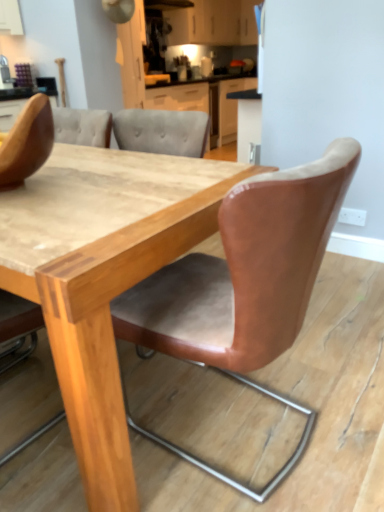
Question: Considering the relative sizes of leather-like tan chair at center, the 1th chair in the right-to-left sequence, and matte white cabinets at upper center in the image provided, is leather-like tan chair at center, the 1th chair in the right-to-left sequence, shorter than matte white cabinets at upper center?

Choices:
 (A) no
 (B) yes

Answer: (A)

Question: Is leather-like tan chair at center, positioned as the second chair in left-to-right order, at the left side of matte white cabinets at upper center?

Choices:
 (A) no
 (B) yes

Answer: (B)

Question: Considering the relative positions of leather-like tan chair at center, the 1th chair in the right-to-left sequence, and matte white cabinets at upper center in the image provided, is leather-like tan chair at center, the 1th chair in the right-to-left sequence, in front of matte white cabinets at upper center?

Choices:
 (A) yes
 (B) no

Answer: (A)

Question: From a real-world perspective, does leather-like tan chair at center, the 1th chair in the right-to-left sequence, stand above matte white cabinets at upper center?

Choices:
 (A) no
 (B) yes

Answer: (A)

Question: Is leather-like tan chair at center, the 1th chair in the right-to-left sequence, with matte white cabinets at upper center?

Choices:
 (A) yes
 (B) no

Answer: (B)

Question: Based on their positions, is leather-like tan chair at center, positioned as the second chair in left-to-right order, located to the left or right of brown leather chair at upper left, which is counted as the 1th chair, starting from the left?

Choices:
 (A) right
 (B) left

Answer: (A)

Question: Considering the positions of leather-like tan chair at center, the 1th chair in the right-to-left sequence, and brown leather chair at upper left, which is counted as the 1th chair, starting from the left, in the image, is leather-like tan chair at center, the 1th chair in the right-to-left sequence, taller or shorter than brown leather chair at upper left, which is counted as the 1th chair, starting from the left,?

Choices:
 (A) short
 (B) tall

Answer: (B)

Question: Considering the positions of leather-like tan chair at center, the 1th chair in the right-to-left sequence, and brown leather chair at upper left, arranged as the second chair when viewed from the right, in the image, is leather-like tan chair at center, the 1th chair in the right-to-left sequence, bigger or smaller than brown leather chair at upper left, arranged as the second chair when viewed from the right,?

Choices:
 (A) big
 (B) small

Answer: (A)

Question: Considering their positions, is leather-like tan chair at center, the 1th chair in the right-to-left sequence, located in front of or behind brown leather chair at upper left, arranged as the second chair when viewed from the right?

Choices:
 (A) front
 (B) behind

Answer: (A)

Question: From a real-world perspective, is matte white cabinets at upper center positioned above or below leather-like tan chair at center, the 1th chair in the right-to-left sequence?

Choices:
 (A) above
 (B) below

Answer: (A)

Question: Does point (208, 26) appear closer or farther from the camera than point (291, 198)?

Choices:
 (A) closer
 (B) farther

Answer: (B)

Question: From the image's perspective, is matte white cabinets at upper center positioned above or below leather-like tan chair at center, positioned as the second chair in left-to-right order?

Choices:
 (A) below
 (B) above

Answer: (B)

Question: Looking at their shapes, would you say matte white cabinets at upper center is wider or thinner than leather-like tan chair at center, the 1th chair in the right-to-left sequence?

Choices:
 (A) thin
 (B) wide

Answer: (A)

Question: Is wooden table at center to the left or to the right of brown leather chair at upper left, which is counted as the 1th chair, starting from the left, in the image?

Choices:
 (A) right
 (B) left

Answer: (B)

Question: Is wooden table at center bigger or smaller than brown leather chair at upper left, which is counted as the 1th chair, starting from the left?

Choices:
 (A) big
 (B) small

Answer: (A)